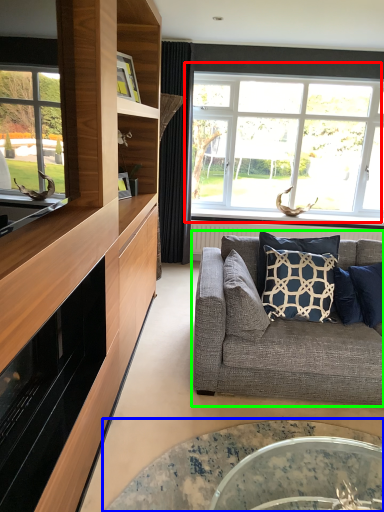
Question: Based on their relative distances, which object is nearer to window (highlighted by a red box)? Choose from coffee table (highlighted by a blue box) and studio couch (highlighted by a green box).

Choices:
 (A) coffee table
 (B) studio couch

Answer: (B)